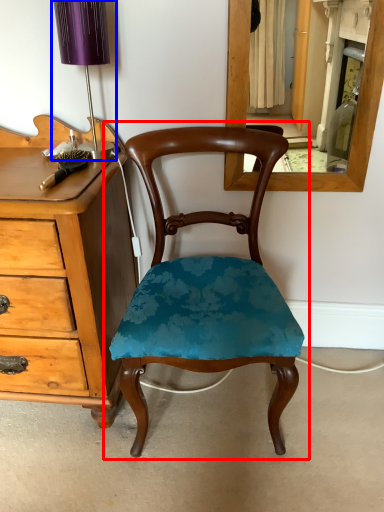
Question: Which point is closer to the camera, chair (highlighted by a red box) or table lamp (highlighted by a blue box)?

Choices:
 (A) chair
 (B) table lamp

Answer: (A)